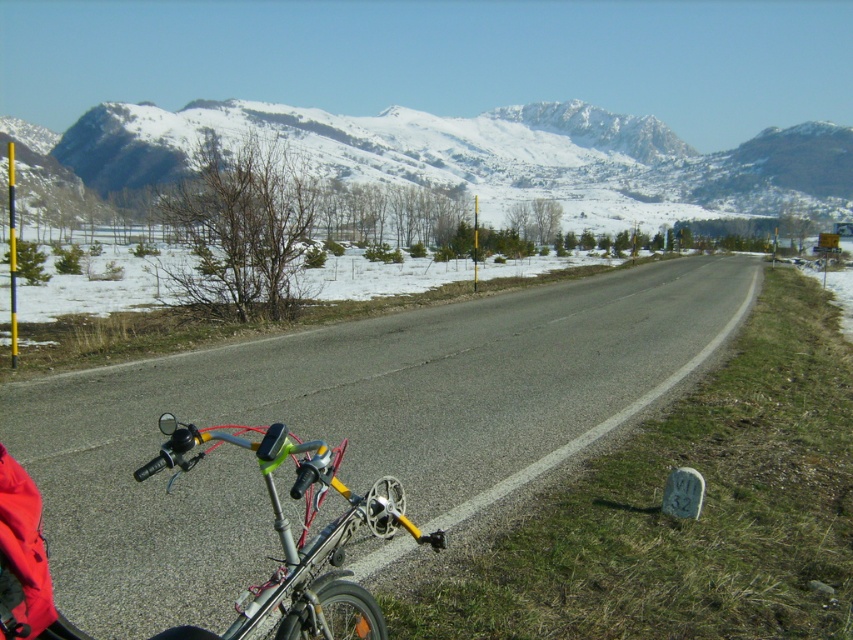
Who is higher up, snowy rocky mountain at upper center or silver metallic bicycle handlebars at lower left?

snowy rocky mountain at upper center

Consider the image. Which is more to the left, snowy rocky mountain at upper center or silver metallic bicycle handlebars at lower left?

Positioned to the left is snowy rocky mountain at upper center.

Who is more distant from viewer, (769, 132) or (294, 547)?

The point (769, 132) is behind.

Identify the location of snowy rocky mountain at upper center. The width and height of the screenshot is (853, 640). (479, 154).